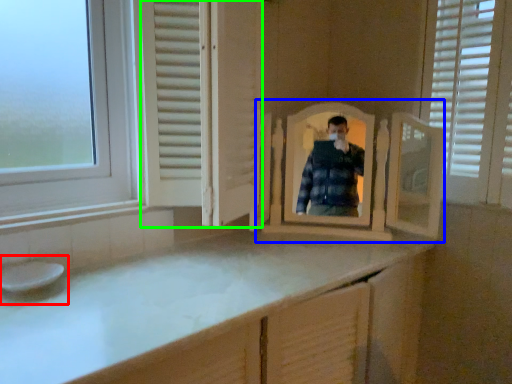
Question: Which object is the closest to the sink (highlighted by a red box)? Choose among these: mirror (highlighted by a blue box) or screen door (highlighted by a green box).

Choices:
 (A) mirror
 (B) screen door

Answer: (B)